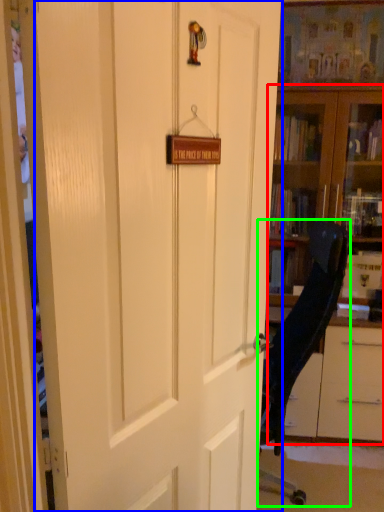
Question: Which object is the closest to the bookcase (highlighted by a red box)? Choose among these: door (highlighted by a blue box) or chair (highlighted by a green box).

Choices:
 (A) door
 (B) chair

Answer: (B)